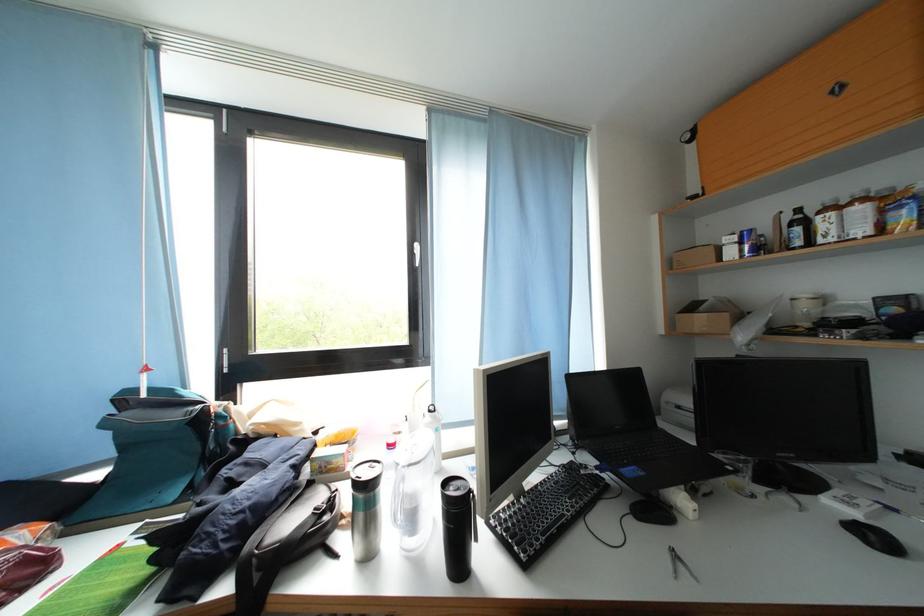
Describe the element at coordinates (412, 490) in the screenshot. I see `the clear water pitcher` at that location.